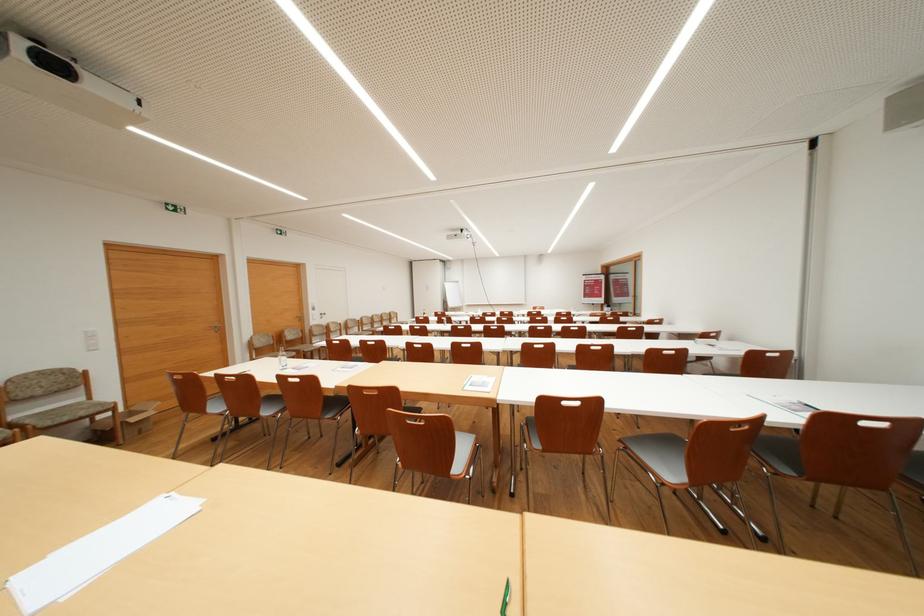
Find where to grasp the wooden chair armrest. Please return your answer as a coordinate pair (x, y).

(423, 460)